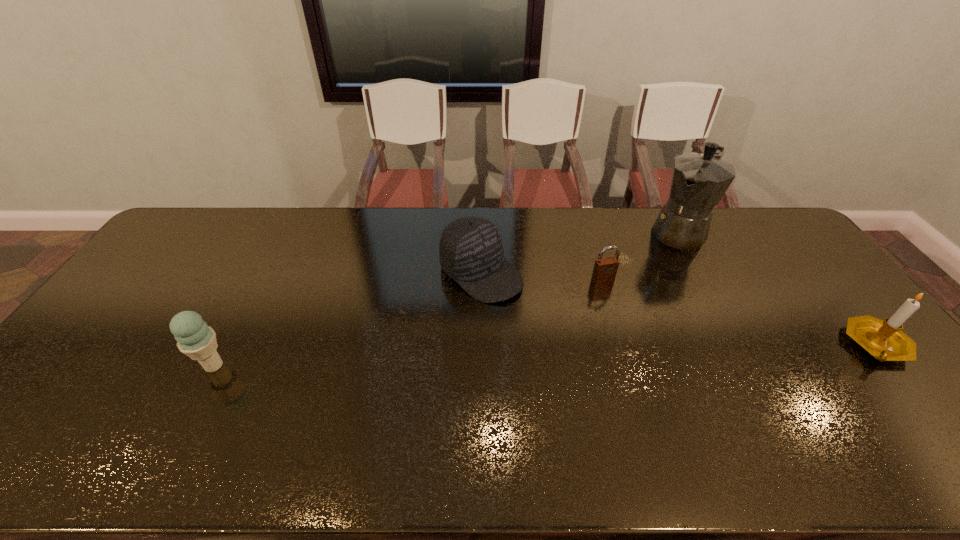
Locate an element on the screen. vacant space on the desktop that is between the ice cream and the rightmost object and is positioned on the front-facing side of the shortest object is located at coordinates (647, 352).

Find the location of a particular element. This screenshot has width=960, height=540. vacant spot on the desktop that is between the ice cream and the candle holder and is positioned on the pouring side of the coffeepot is located at coordinates (580, 354).

In order to click on free spot on the desktop that is between the leftmost object and the rightmost object and is positioned at the front of the baseball cap where the brim is located in this screenshot , I will do `click(584, 354)`.